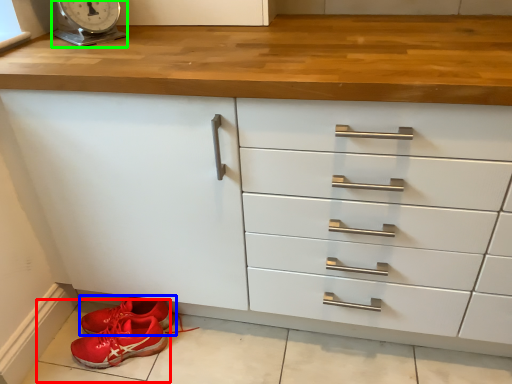
Question: Based on their relative distances, which object is nearer to tile (highlighted by a red box)? Choose from footwear (highlighted by a blue box) and scale (highlighted by a green box).

Choices:
 (A) footwear
 (B) scale

Answer: (A)